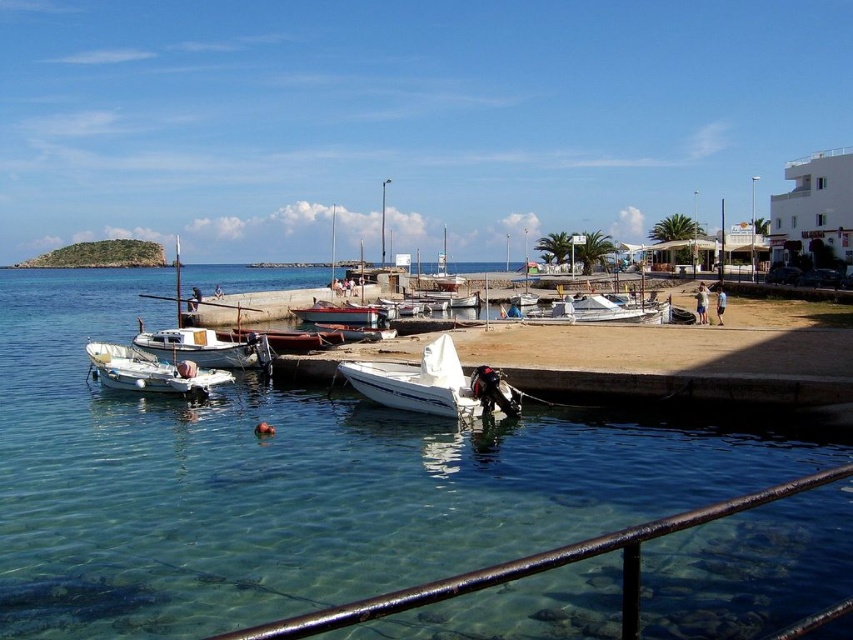
You are standing on the pier and see the white matte motorboat at center and the white matte boat at lower left. Which boat is nearer to you?

The white matte motorboat at center is closer to the viewer than the white matte boat at lower left.